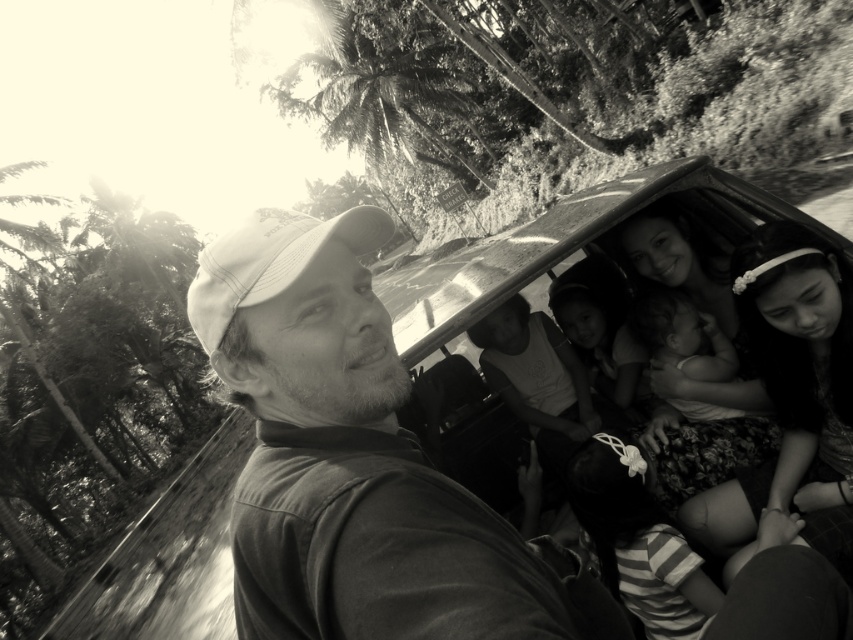
You are a photographer trying to capture a closeup of the striped fabric shirt at lower center and the white fabric baseball cap at center. Since the camera can only focus on one object at a time, which object should you choose to ensure it appears larger in the photo?

The striped fabric shirt at lower center has a smaller size compared to the white fabric baseball cap at center, so you should choose to focus on the white fabric baseball cap at center to ensure it appears larger in the photo.

You are standing in front of the black and white photo of the jeepney ride. You see a point at coordinates [270,260]. Which object in the photo does this point belong to?

The point at coordinates [270,260] is on the white fabric baseball cap at center.